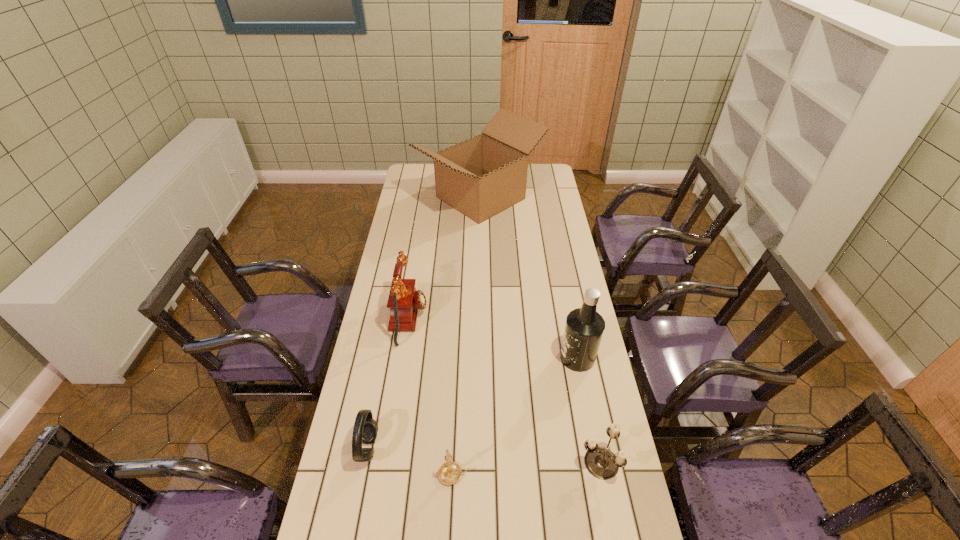
Identify the location of free space located 0.230m on the dial of the third tallest object. (490, 319).

This screenshot has width=960, height=540. In order to click on free space located 0.380m on the handle side of the left candle holder in this screenshot , I will do `click(607, 475)`.

At what (x,y) coordinates should I click in order to perform the action: click on vacant space situated on the left of the right candle holder. Please return your answer as a coordinate pair (x, y). Looking at the image, I should click on (454, 462).

This screenshot has width=960, height=540. I want to click on free space located on the earcups of the headset, so click(x=437, y=448).

You are a GUI agent. You are given a task and a screenshot of the screen. Output one action in this format:
    pyautogui.click(x=<x>, y=<y>)
    Task: Click on the object that is at the far edge
    The width and height of the screenshot is (960, 540).
    Given the screenshot: What is the action you would take?
    pyautogui.click(x=480, y=177)

The image size is (960, 540). I want to click on box that is at the left edge, so click(x=480, y=177).

This screenshot has height=540, width=960. Find the location of `telephone that is at the left edge`. telephone that is at the left edge is located at coordinates (404, 301).

Where is `headset that is at the left edge`? Image resolution: width=960 pixels, height=540 pixels. headset that is at the left edge is located at coordinates (365, 429).

Locate an element on the screen. The width and height of the screenshot is (960, 540). box located in the right edge section of the desktop is located at coordinates (480, 177).

The height and width of the screenshot is (540, 960). Find the location of `liquor at the right edge`. liquor at the right edge is located at coordinates (584, 328).